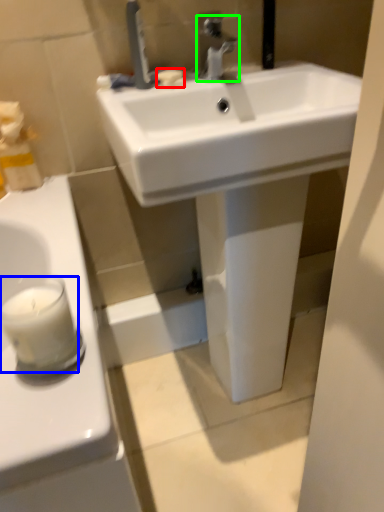
Question: Which object is positioned farthest from soap (highlighted by a red box)? Select from candle (highlighted by a blue box) and tap (highlighted by a green box).

Choices:
 (A) candle
 (B) tap

Answer: (A)